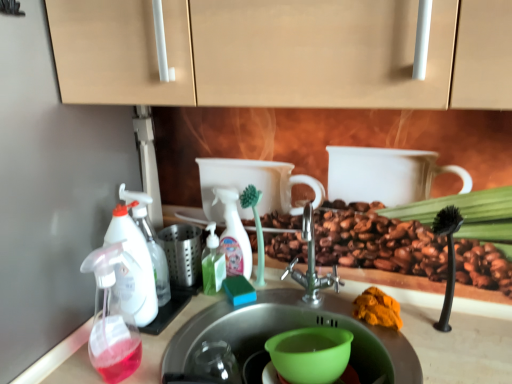
The height and width of the screenshot is (384, 512). Find the location of `free spot to the right of translucent plastic soap dispenser at left, which ranks as the second soap dispenser in back-to-front order`. free spot to the right of translucent plastic soap dispenser at left, which ranks as the second soap dispenser in back-to-front order is located at coordinates (192, 311).